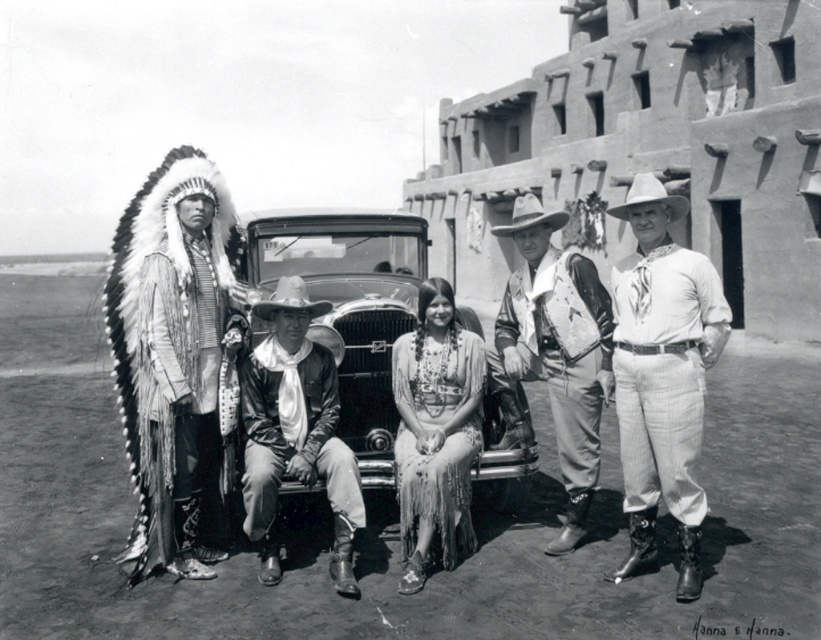
Question: Which object is positioned farthest from the white felt cowboy hat at upper right?

Choices:
 (A) white cotton shirt at right
 (B) white felt cowboy hat at center

Answer: (B)

Question: Can you confirm if white feathered headdress at left is bigger than leather vest at center?

Choices:
 (A) yes
 (B) no

Answer: (B)

Question: Is leather vest at center closer to the viewer compared to fringed fabric dress at center?

Choices:
 (A) no
 (B) yes

Answer: (A)

Question: Among these points, which one is nearest to the camera?

Choices:
 (A) (673, 196)
 (B) (526, 218)
 (C) (319, 225)
 (D) (437, 440)

Answer: (A)

Question: Can you confirm if white feathered headdress at left is positioned to the left of white felt cowboy hat at upper right?

Choices:
 (A) yes
 (B) no

Answer: (A)

Question: Which point appears closest to the camera in this image?

Choices:
 (A) (516, 218)
 (B) (255, 371)
 (C) (700, 312)

Answer: (C)